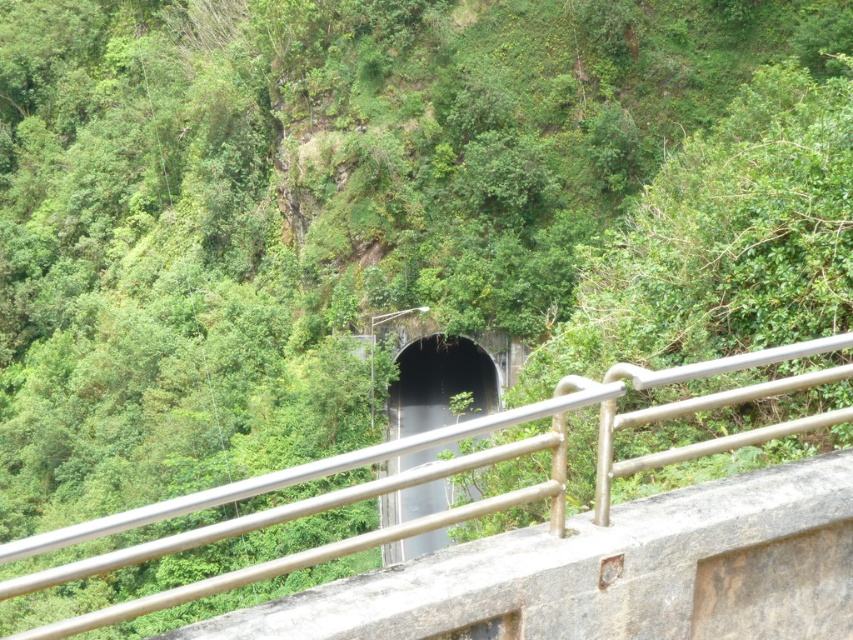
You are a maintenance worker needing to inspect the metallic gray rail at center and the black concrete tunnel at center. Based on their positions, which object is located higher from the ground?

The metallic gray rail at center is above the black concrete tunnel at center, so the metallic gray rail at center is higher from the ground.

You are a painter who needs to decide which object to paint first. The metallic gray rail at center and the black concrete tunnel at center are both in your view. Based on their widths, which one do you think requires more paint?

The metallic gray rail at center might be wider than the black concrete tunnel at center, so it likely requires more paint.